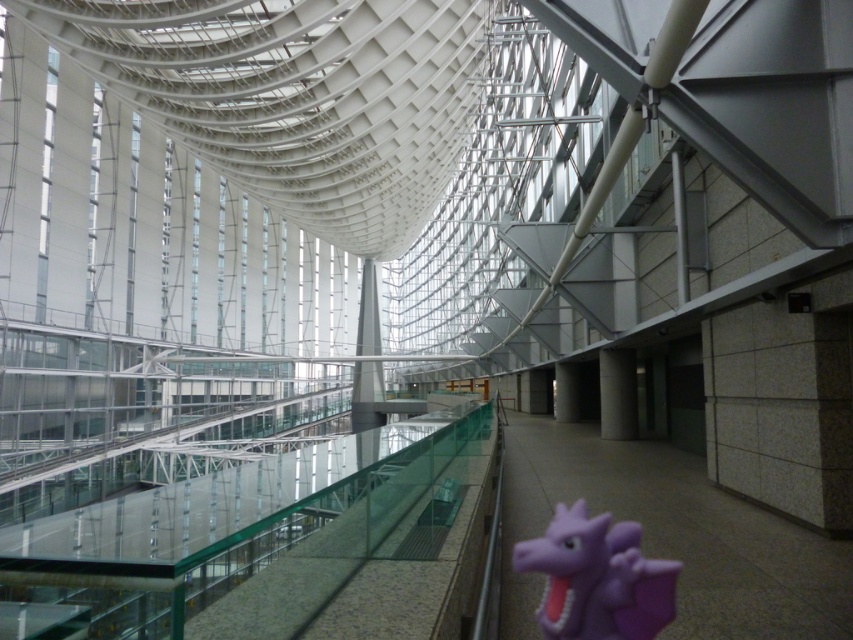
Question: Which object is closer to the camera taking this photo?

Choices:
 (A) white concrete pillar at center
 (B) white smooth pillar at center
 (C) purple rubber dragon at lower right
 (D) white glossy pillar at center

Answer: (D)

Question: In this image, where is white glossy pillar at center located relative to white concrete pillar at center?

Choices:
 (A) right
 (B) left

Answer: (B)

Question: Which of the following is the farthest from the observer?

Choices:
 (A) (364, 384)
 (B) (570, 397)
 (C) (618, 435)
 (D) (631, 532)

Answer: (A)

Question: Which object is positioned closest to the white concrete pillar at center?

Choices:
 (A) white glossy pillar at center
 (B) purple rubber dragon at lower right

Answer: (B)

Question: Considering the relative positions of white glossy pillar at center and white concrete pillar at center in the image provided, where is white glossy pillar at center located with respect to white concrete pillar at center?

Choices:
 (A) above
 (B) below

Answer: (A)

Question: Is white glossy pillar at center positioned before white smooth pillar at center?

Choices:
 (A) yes
 (B) no

Answer: (A)